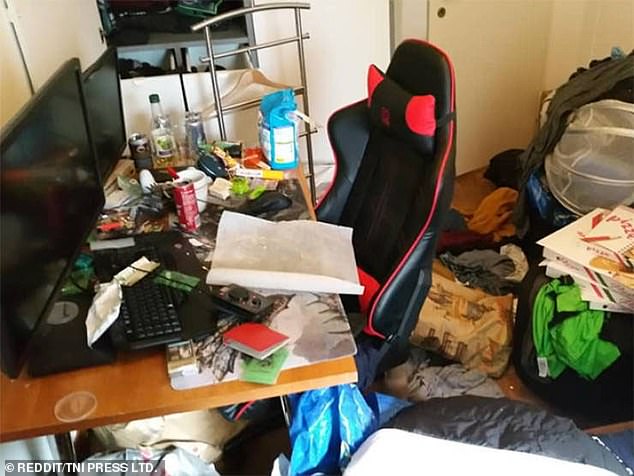
Image resolution: width=634 pixels, height=476 pixels. What are the coordinates of `desk` in the screenshot? It's located at (136, 388).